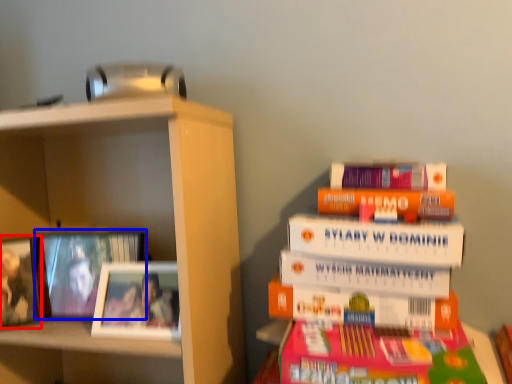
Question: Which of the following is the farthest to the observer, picture frame (highlighted by a red box) or picture frame (highlighted by a blue box)?

Choices:
 (A) picture frame
 (B) picture frame

Answer: (B)